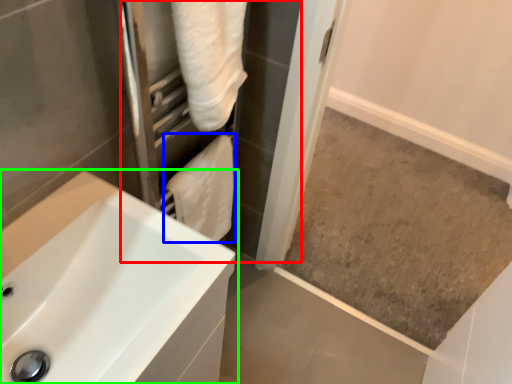
Question: Based on their relative distances, which object is nearer to screen door (highlighted by a red box)? Choose from bath towel (highlighted by a blue box) and sink (highlighted by a green box).

Choices:
 (A) bath towel
 (B) sink

Answer: (A)